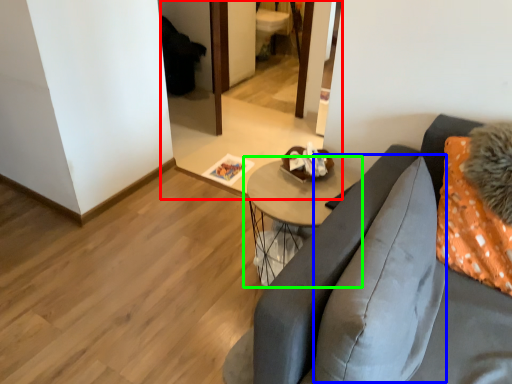
Question: Which object is the closest to the mirror (highlighted by a red box)? Choose among these: pillow (highlighted by a blue box) or table (highlighted by a green box).

Choices:
 (A) pillow
 (B) table

Answer: (B)